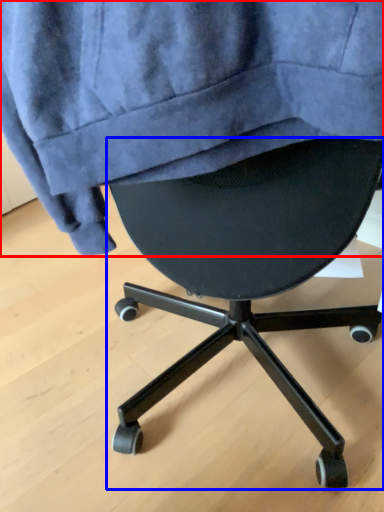
Question: Which object appears closest to the camera in this image, sweatshirt (highlighted by a red box) or chair (highlighted by a blue box)?

Choices:
 (A) sweatshirt
 (B) chair

Answer: (A)